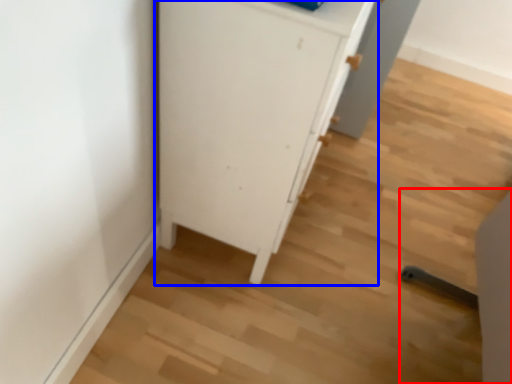
Question: Among these objects, which one is farthest to the camera, chair (highlighted by a red box) or cupboard (highlighted by a blue box)?

Choices:
 (A) chair
 (B) cupboard

Answer: (B)